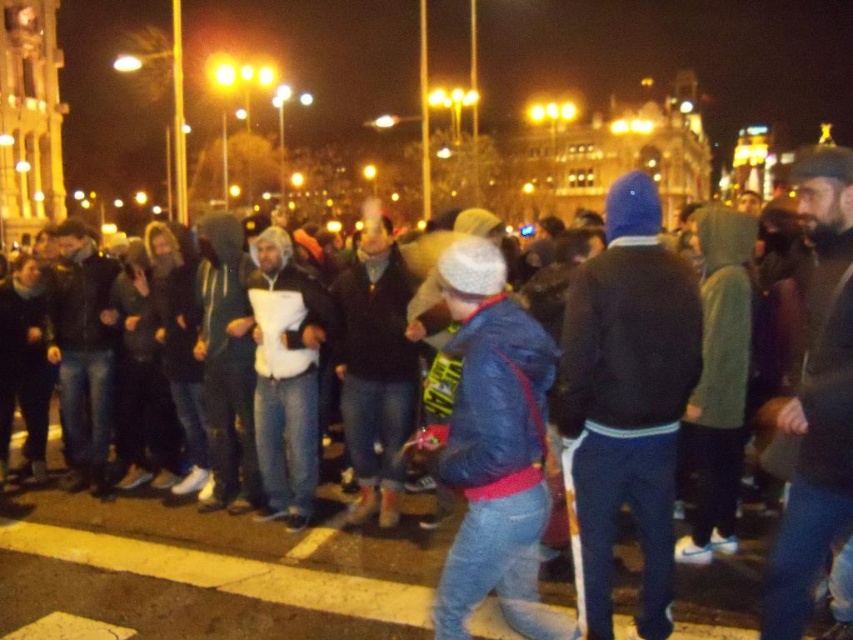
Question: Observing the image, what is the correct spatial positioning of dark brown sweater at center in reference to white matte hoodie at center?

Choices:
 (A) above
 (B) below

Answer: (B)

Question: Which object appears closest to the camera in this image?

Choices:
 (A) white matte hoodie at center
 (B) dark brown sweater at center
 (C) blue leather jacket at center

Answer: (C)

Question: Is dark brown sweater at center further to camera compared to white matte hoodie at center?

Choices:
 (A) yes
 (B) no

Answer: (B)

Question: Which of the following is the farthest from the observer?

Choices:
 (A) blue leather jacket at center
 (B) dark brown sweater at center
 (C) white matte hoodie at center

Answer: (C)

Question: Does blue leather jacket at center come behind white matte hoodie at center?

Choices:
 (A) yes
 (B) no

Answer: (B)

Question: Estimate the real-world distances between objects in this image. Which object is closer to the dark brown sweater at center?

Choices:
 (A) blue leather jacket at center
 (B) white matte hoodie at center

Answer: (A)